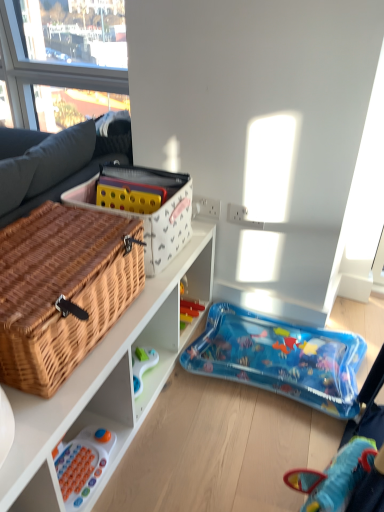
This screenshot has height=512, width=384. In order to click on vacant area on top of white plastic toy at lower left, which is the 1th toy from front to back (from a real-world perspective) in this screenshot , I will do pyautogui.click(x=73, y=458).